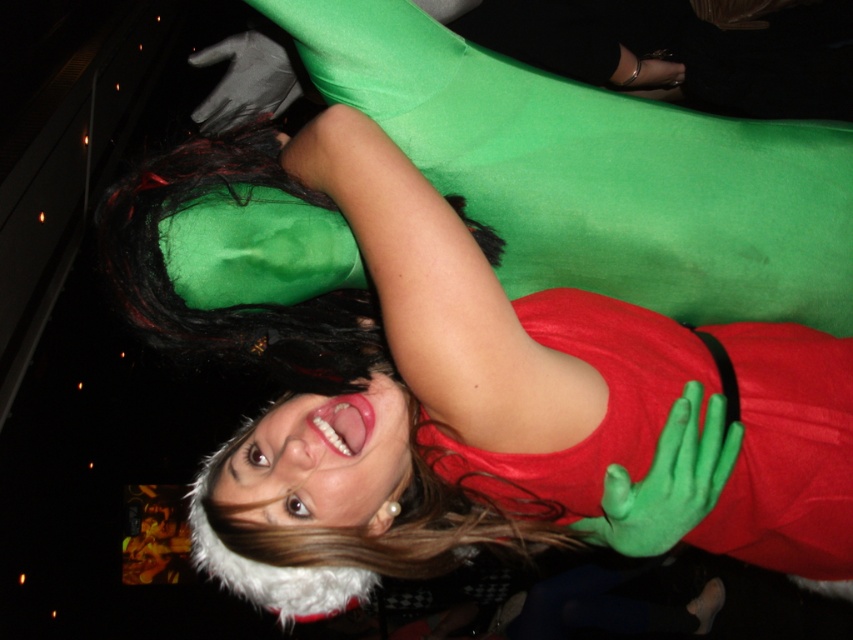
You are at a party and notice two pairs of gloves on a table. One is labeled as matte green gloves at upper center and the other as green matte gloves at upper center. Which pair is positioned to the left?

The matte green gloves at upper center are positioned to the left of the green matte gloves at upper center.

You are a photographer setting up for a photoshoot and notice the matte green gloves at upper center and the green matte gloves at upper center in the frame. Which pair of gloves is positioned higher in the image?

The matte green gloves at upper center is located above the green matte gloves at upper center, so it is positioned higher in the image.

You are a photographer trying to capture the perfect shot of the matte green gloves at upper center. The camera is set to focus at point coordinates of 0.5 and 0.5. Will the gloves be in focus?

The matte green gloves at upper center are positioned at point coordinates of 0.553 and 0.476, which is very close to the camera focus point of 0.5 and 0.5. Therefore, they will likely be in focus.